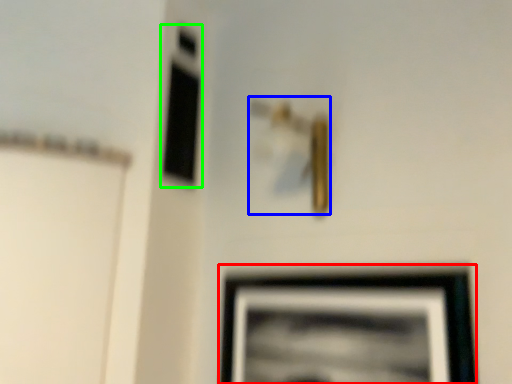
Question: Which object is the closest to the picture frame (highlighted by a red box)? Choose among these: door handle (highlighted by a blue box) or window (highlighted by a green box).

Choices:
 (A) door handle
 (B) window

Answer: (A)